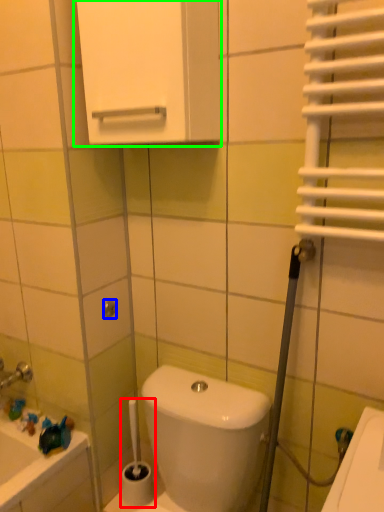
Question: Which is farther away from brush (highlighted by a red box)? shower (highlighted by a blue box) or medicine cabinet (highlighted by a green box)?

Choices:
 (A) shower
 (B) medicine cabinet

Answer: (B)